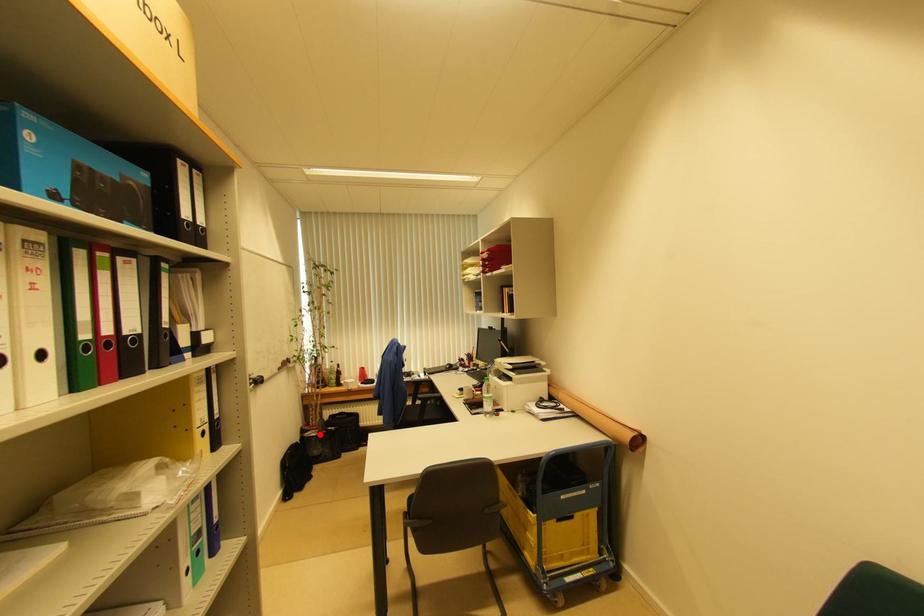
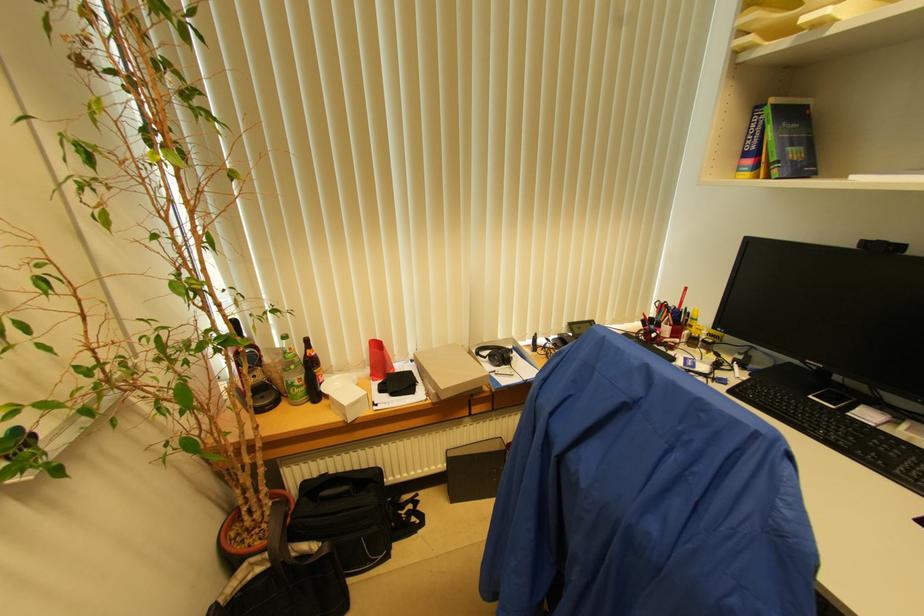
The point at the highlighted location is marked in the first image. Where is the corresponding point in the second image?

(273, 561)